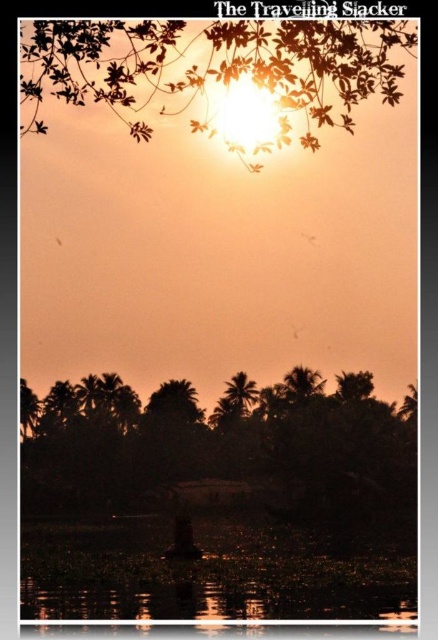
Based on the photo, which is more to the right, silhouette leafy branch at upper center or translucent dark water at lower center?

silhouette leafy branch at upper center

Is point (98, 72) positioned after point (295, 536)?

No, it is not.

The width and height of the screenshot is (438, 640). What are the coordinates of `silhouette leafy branch at upper center` in the screenshot? It's located at (x=216, y=72).

Can you confirm if silhouette palm trees at lower center is shorter than translucent dark water at lower center?

In fact, silhouette palm trees at lower center may be taller than translucent dark water at lower center.

Consider the image. Who is shorter, silhouette palm trees at lower center or translucent dark water at lower center?

translucent dark water at lower center

Between point (268, 412) and point (269, 548), which one is positioned in front?

Positioned in front is point (269, 548).

This screenshot has height=640, width=438. Identify the location of silhouette palm trees at lower center. (218, 444).

Who is more distant from viewer, (137, 504) or (110, 60)?

The point (137, 504) is more distant.

Can you confirm if silhouette palm trees at lower center is shorter than silhouette leafy branch at upper center?

Indeed, silhouette palm trees at lower center has a lesser height compared to silhouette leafy branch at upper center.

Between point (151, 420) and point (48, 70), which one is positioned in front?

Point (48, 70) is more forward.

Where is `silhouette palm trees at lower center`? The image size is (438, 640). silhouette palm trees at lower center is located at coordinates (218, 444).